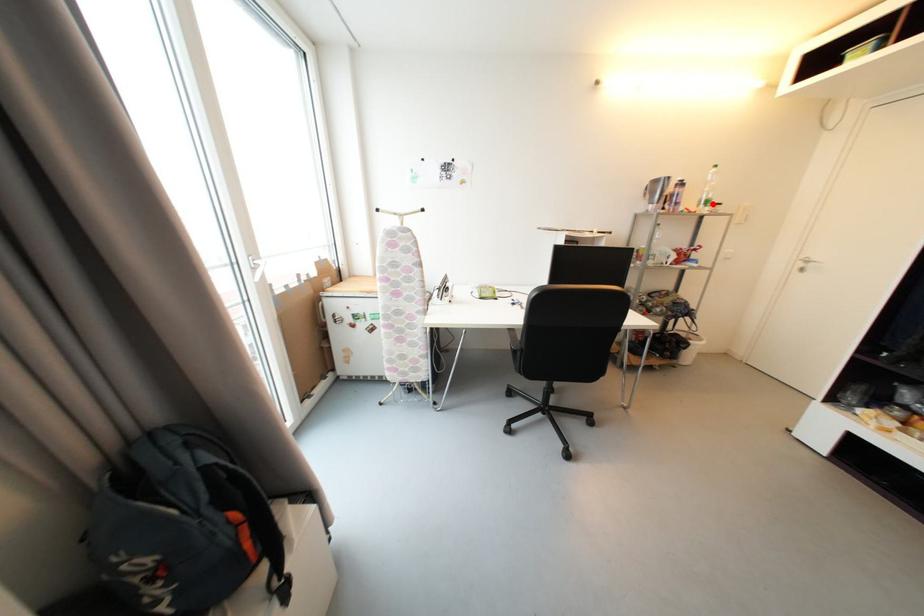
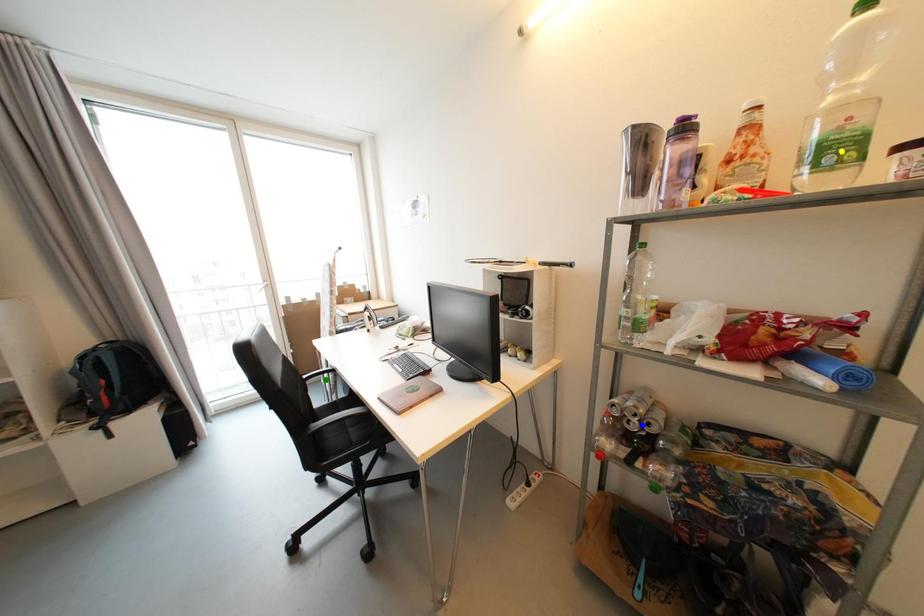
Question: I am providing you with two images of the same scene from different viewpoints. A red point is marked on the first image. You are given multiple points on the second image. Which point in image 2 represents the same 3d spot as the red point in image 1?

Choices:
 (A) green point
 (B) blue point
 (C) yellow point

Answer: (C)